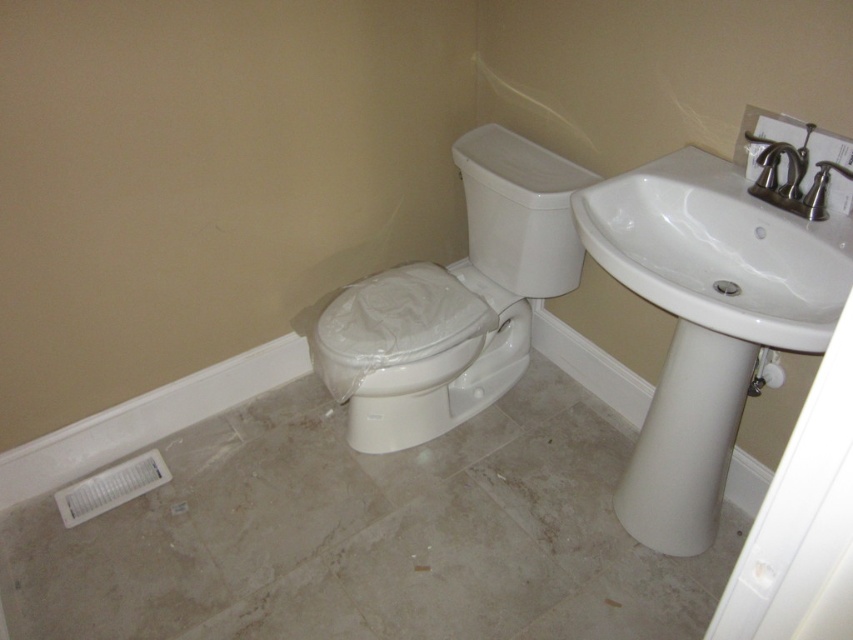
Which of these two, white glossy sink at upper right or matte black faucet at upper right, stands shorter?

Standing shorter between the two is matte black faucet at upper right.

Between point (770, 259) and point (805, 166), which one is positioned behind?

Positioned behind is point (770, 259).

The width and height of the screenshot is (853, 640). Describe the element at coordinates (718, 252) in the screenshot. I see `white glossy sink at upper right` at that location.

Locate an element on the screen. white glossy sink at upper right is located at coordinates (718, 252).

Can you confirm if white glossy toilet at center is shorter than white glossy sink at upper right?

Incorrect, white glossy toilet at center's height does not fall short of white glossy sink at upper right's.

Which is more to the left, white glossy toilet at center or white glossy sink at upper right?

white glossy toilet at center is more to the left.

Between point (375, 362) and point (796, 304), which one is positioned behind?

The point (375, 362) is more distant.

Find the location of a particular element. The image size is (853, 640). white glossy toilet at center is located at coordinates (456, 300).

The image size is (853, 640). What do you see at coordinates (456, 300) in the screenshot?
I see `white glossy toilet at center` at bounding box center [456, 300].

The width and height of the screenshot is (853, 640). What are the coordinates of `white glossy toilet at center` in the screenshot? It's located at (456, 300).